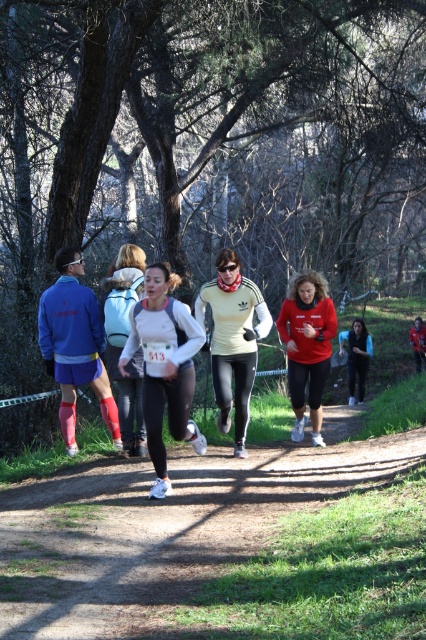
Question: Based on their relative distances, which object is farther from the red matte running top at center?

Choices:
 (A) smooth dirt path at center
 (B) matte yellow top at center
 (C) white matte running shoes at center

Answer: (C)

Question: Which of the following is the closest to the observer?

Choices:
 (A) white jersey at center
 (B) red matte running top at center
 (C) matte yellow top at center

Answer: (A)

Question: Can you confirm if red matte running top at center is positioned to the right of black matte leggings at center?

Choices:
 (A) yes
 (B) no

Answer: (B)

Question: Estimate the real-world distances between objects in this image. Which object is farther from the smooth dirt path at center?

Choices:
 (A) white jersey at center
 (B) red matte running top at center
 (C) white matte running shoes at center
 (D) black matte leggings at center

Answer: (D)

Question: Is smooth dirt path at center smaller than white matte running shoes at center?

Choices:
 (A) no
 (B) yes

Answer: (B)

Question: Is smooth dirt path at center behind black matte leggings at center?

Choices:
 (A) yes
 (B) no

Answer: (B)